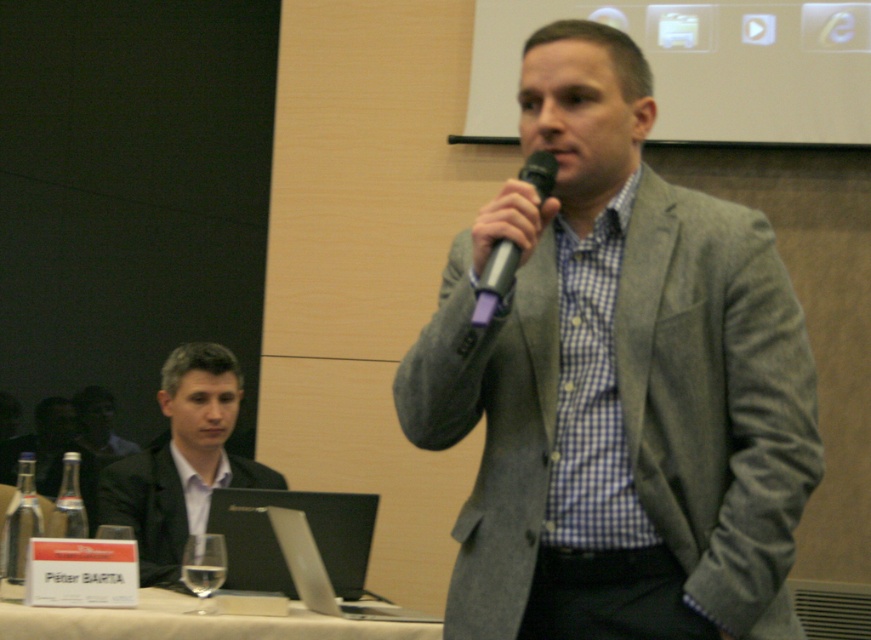
Question: Estimate the real-world distances between objects in this image. Which object is closer to the gray woolen blazer at center?

Choices:
 (A) silver metallic microphone at center
 (B) black matte laptop at lower center
 (C) white glossy table at lower center
 (D) black glossy suit at left

Answer: (A)

Question: Considering the relative positions of silver metallic laptop at lower center and silver metallic microphone at center in the image provided, where is silver metallic laptop at lower center located with respect to silver metallic microphone at center?

Choices:
 (A) below
 (B) above

Answer: (A)

Question: Where is gray woolen blazer at center located in relation to black matte laptop at lower center in the image?

Choices:
 (A) left
 (B) right

Answer: (B)

Question: Among these points, which one is farthest from the camera?

Choices:
 (A) (647, 282)
 (B) (490, 273)
 (C) (295, 561)

Answer: (C)

Question: Can you confirm if white glossy table at lower center is thinner than silver metallic microphone at center?

Choices:
 (A) yes
 (B) no

Answer: (B)

Question: Among these points, which one is farthest from the camera?

Choices:
 (A) (181, 451)
 (B) (147, 616)
 (C) (740, 236)

Answer: (A)